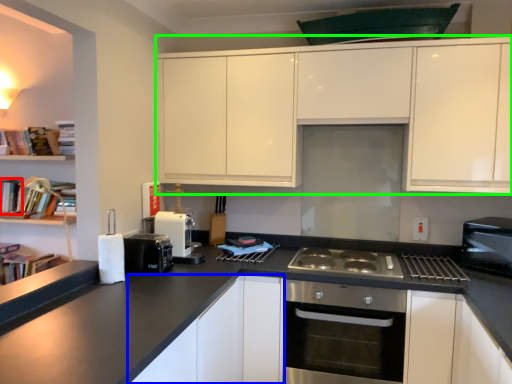
Question: Based on their relative distances, which object is farther from book (highlighted by a red box)? Choose from cabinetry (highlighted by a blue box) and cabinetry (highlighted by a green box).

Choices:
 (A) cabinetry
 (B) cabinetry

Answer: (B)